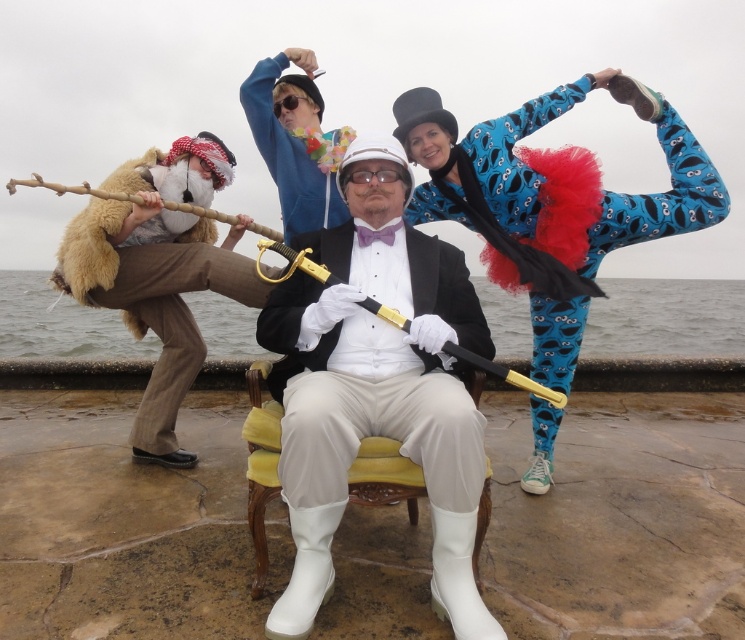
Question: Which of the following is the closest to the observer?

Choices:
 (A) blue hoodie at upper center
 (B) matte black suit at center
 (C) yellow fabric chair at center

Answer: (B)

Question: Among these points, which one is nearest to the camera?

Choices:
 (A) (472, 532)
 (B) (440, 108)

Answer: (A)

Question: Estimate the real-world distances between objects in this image. Which object is closer to the blue hoodie at upper center?

Choices:
 (A) blue spandex tights at upper right
 (B) yellow fabric chair at center

Answer: (A)

Question: Is blue hoodie at upper center positioned before yellow fabric chair at center?

Choices:
 (A) no
 (B) yes

Answer: (A)

Question: Can you confirm if matte black suit at center is wider than yellow fabric chair at center?

Choices:
 (A) no
 (B) yes

Answer: (A)

Question: Does blue spandex tights at upper right have a lesser width compared to yellow fabric chair at center?

Choices:
 (A) no
 (B) yes

Answer: (A)